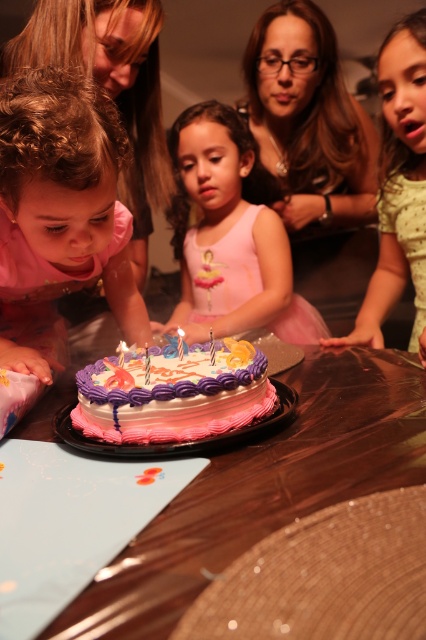
Who is taller, pink satin dress at center or white wax candle at center?

With more height is pink satin dress at center.

Between point (192, 150) and point (178, 353), which one is positioned behind?

Positioned behind is point (192, 150).

This screenshot has width=426, height=640. Find the location of `pink satin dress at center`. pink satin dress at center is located at coordinates (229, 237).

Between point (163, 404) and point (146, 368), which one is positioned behind?

The point (146, 368) is behind.

Can you confirm if pink frosted cake at center is positioned to the left of white paper birthday candle at center?

In fact, pink frosted cake at center is to the right of white paper birthday candle at center.

Image resolution: width=426 pixels, height=640 pixels. Find the location of `pink frosted cake at center`. pink frosted cake at center is located at coordinates 173,396.

Image resolution: width=426 pixels, height=640 pixels. In order to click on pink frosted cake at center in this screenshot , I will do `click(173, 396)`.

Is white wax candle at center taller than white paper birthday candle at center?

Indeed, white wax candle at center has a greater height compared to white paper birthday candle at center.

Which is more to the left, white wax candle at center or white paper birthday candle at center?

white paper birthday candle at center is more to the left.

Locate an element on the screen. This screenshot has width=426, height=640. white wax candle at center is located at coordinates (181, 342).